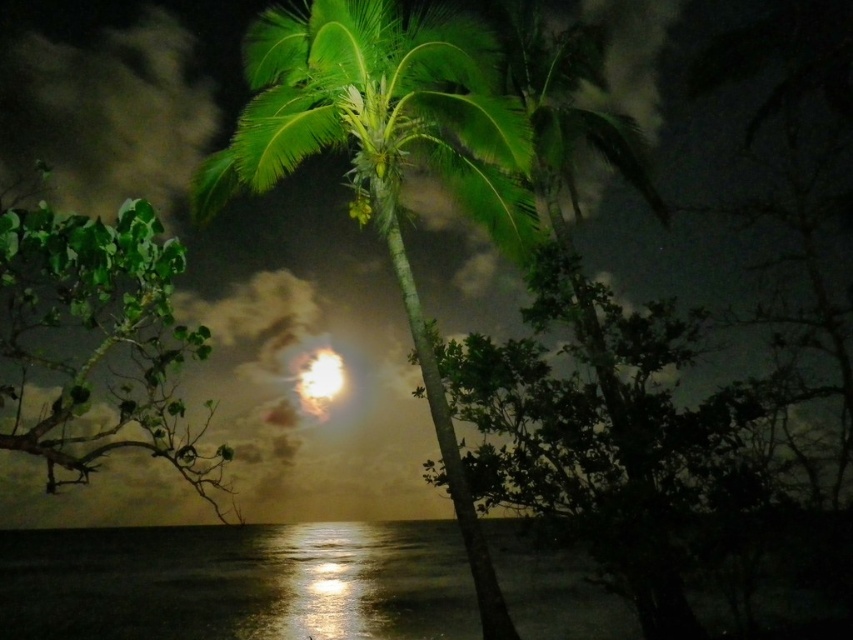
Looking at this image, does green leafy branch at left have a smaller size compared to bright white orb at center?

No.

Between green leafy branch at left and bright white orb at center, which one has more height?

With more height is green leafy branch at left.

You are a GUI agent. You are given a task and a screenshot of the screen. Output one action in this format:
    pyautogui.click(x=<x>, y=<y>)
    Task: Click on the green leafy branch at left
    The height and width of the screenshot is (640, 853).
    Given the screenshot: What is the action you would take?
    pyautogui.click(x=96, y=339)

This screenshot has width=853, height=640. Identify the location of green leafy branch at left. (96, 339).

What do you see at coordinates (387, 160) in the screenshot?
I see `green leafy coconut tree at center` at bounding box center [387, 160].

Does green leafy coconut tree at center come in front of green leafy branch at left?

No, green leafy coconut tree at center is further to the viewer.

Is point (212, 173) positioned in front of point (20, 269)?

No, it is not.

Find the location of a particular element. The width and height of the screenshot is (853, 640). green leafy coconut tree at center is located at coordinates [387, 160].

Based on the photo, measure the distance between green leafy coconut tree at center and camera.

A distance of 9.36 meters exists between green leafy coconut tree at center and camera.

Can you confirm if green leafy coconut tree at center is shorter than bright white orb at center?

Indeed, green leafy coconut tree at center has a lesser height compared to bright white orb at center.

Where is `green leafy coconut tree at center`? The height and width of the screenshot is (640, 853). green leafy coconut tree at center is located at coordinates (387, 160).